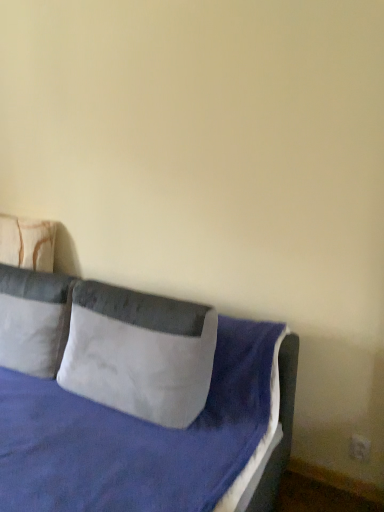
Question: Is velvet blue bed at center inside or outside of gray suede pillow at center, acting as the 3th pillow starting from the left?

Choices:
 (A) inside
 (B) outside

Answer: (B)

Question: From a real-world perspective, relative to gray suede pillow at center, which ranks as the first pillow in right-to-left order, is velvet blue bed at center vertically above or below?

Choices:
 (A) below
 (B) above

Answer: (A)

Question: Estimate the real-world distances between objects in this image. Which object is farther from the white soft pillow at left, arranged as the 2th pillow when viewed from the right?

Choices:
 (A) velvet blue bed at center
 (B) gray suede pillow at center, which ranks as the first pillow in right-to-left order
 (C) beige fabric pillow at left, which appears as the third pillow when viewed from the right

Answer: (C)

Question: Based on their relative distances, which object is nearer to the white soft pillow at left, arranged as the 2th pillow when viewed from the right?

Choices:
 (A) beige fabric pillow at left, marked as the first pillow in a left-to-right arrangement
 (B) velvet blue bed at center
 (C) gray suede pillow at center, which ranks as the first pillow in right-to-left order

Answer: (B)